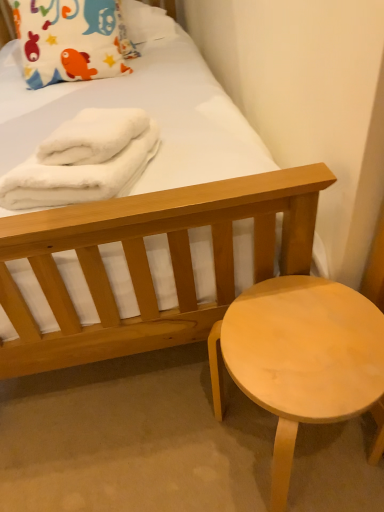
Identify the location of empty space that is ontop of light wood stool at lower right. (304, 343).